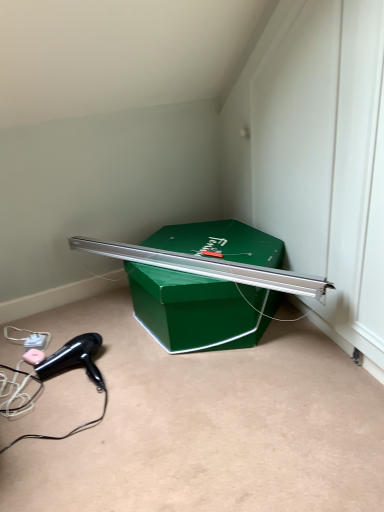
In order to click on free space on the front side of green matte box at center in this screenshot , I will do `click(221, 414)`.